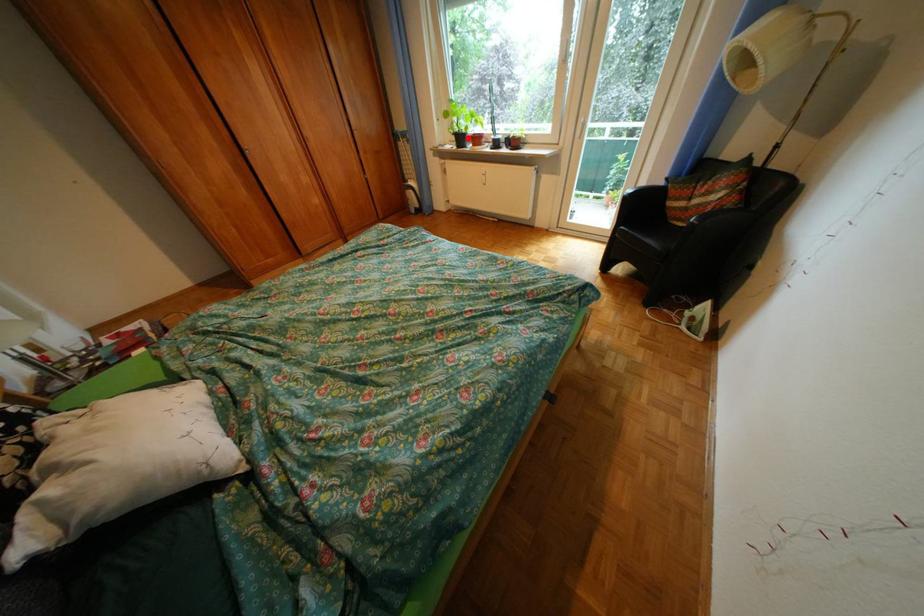
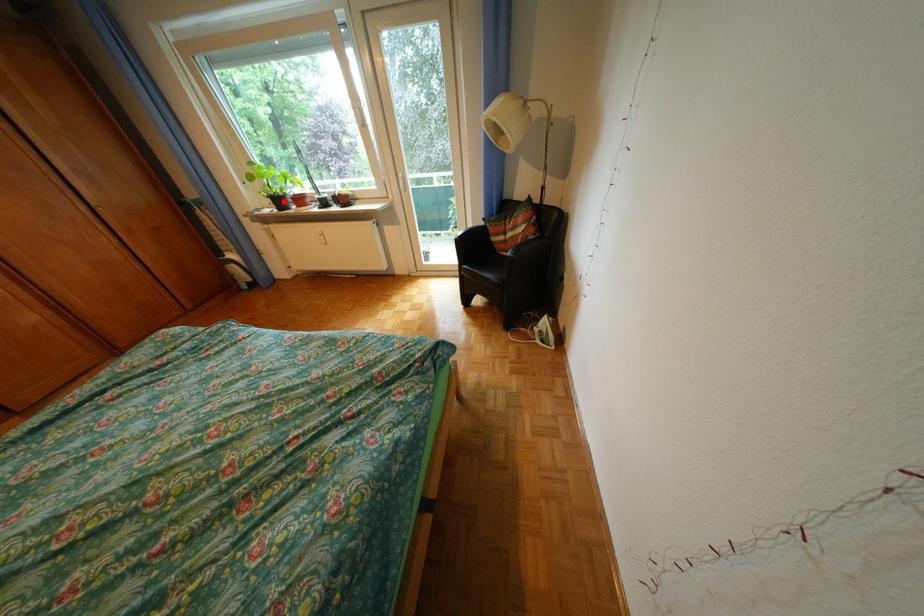
I am providing you with two images of the same scene from different viewpoints. A red point is marked on the first image and another point is marked on the second image. Are the points marked in image1 and image2 representing the same 3D position?

Yes